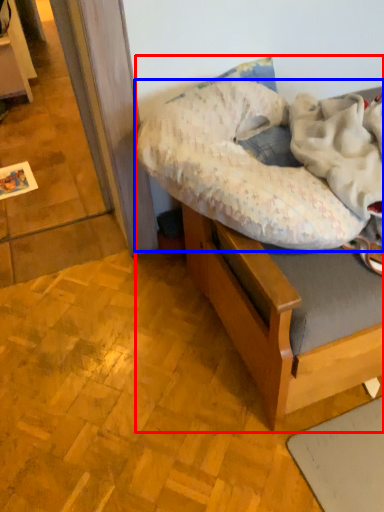
Question: Which object appears closest to the camera in this image, hospital bed (highlighted by a red box) or pillow (highlighted by a blue box)?

Choices:
 (A) hospital bed
 (B) pillow

Answer: (B)